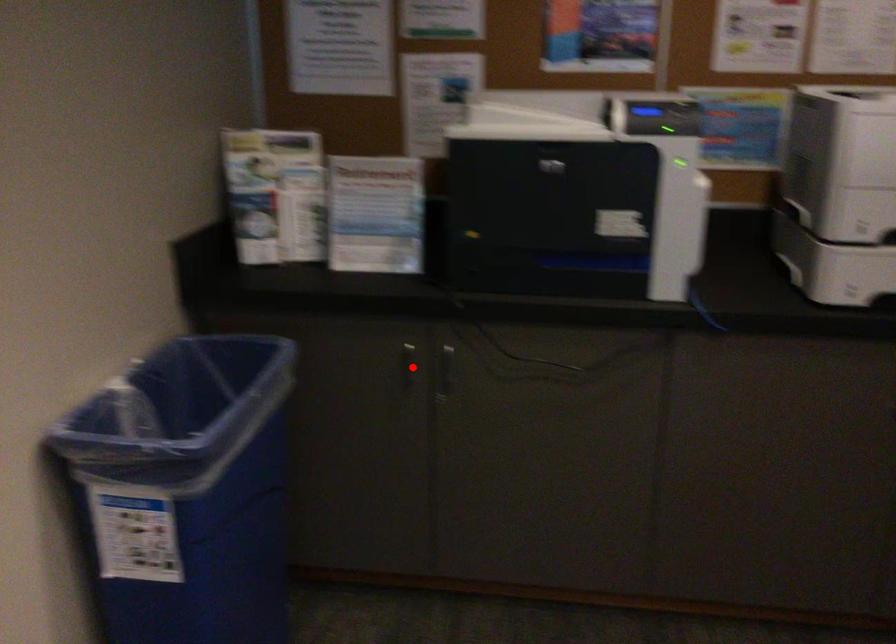
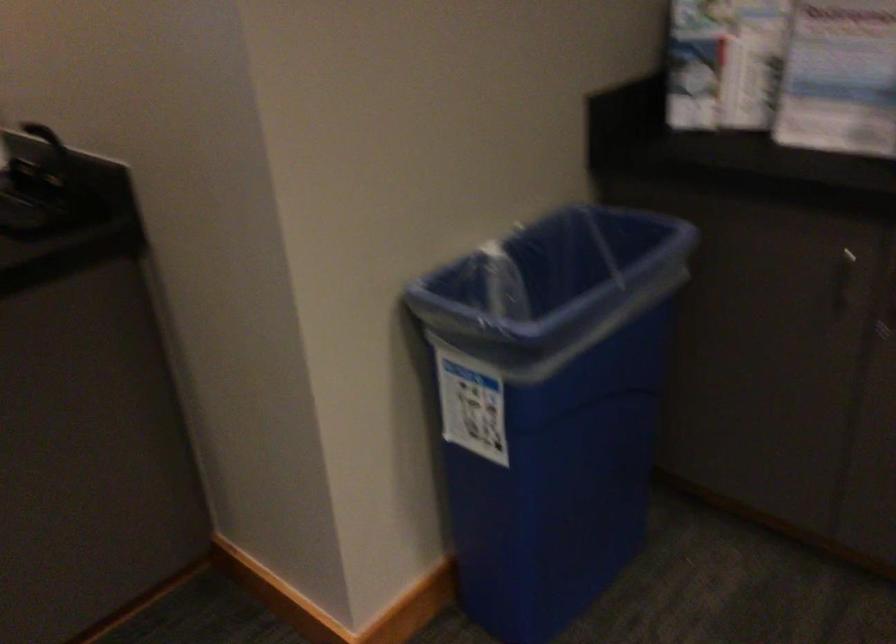
The point at the highlighted location is marked in the first image. Where is the corresponding point in the second image?

(842, 279)